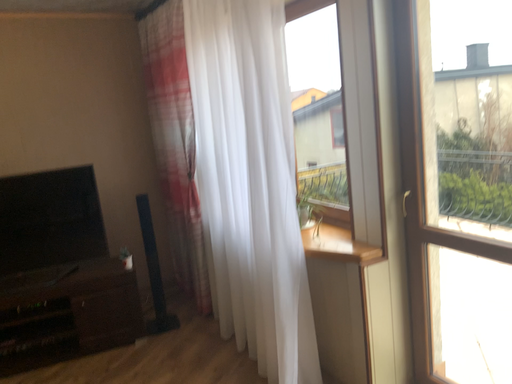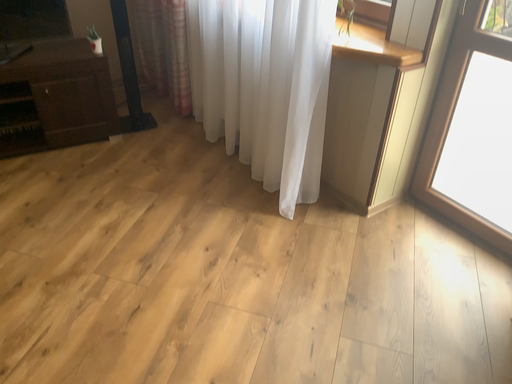
Question: How did the camera likely rotate when shooting the video?

Choices:
 (A) rotated right
 (B) rotated left

Answer: (A)